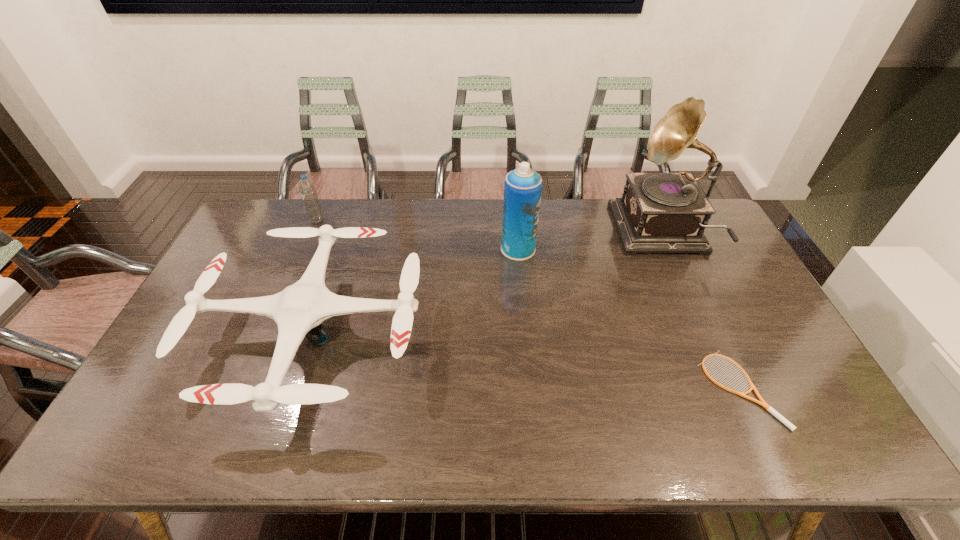
Identify the location of free space that is in between the third shortest object and the shortest object. The height and width of the screenshot is (540, 960). (529, 305).

This screenshot has width=960, height=540. Find the location of `blank region between the aerosol can and the tallest object`. blank region between the aerosol can and the tallest object is located at coordinates (589, 242).

This screenshot has height=540, width=960. I want to click on vacant area between the third tallest object and the fourth shortest object, so click(x=418, y=235).

At what (x,y) coordinates should I click in order to perform the action: click on free space between the drone and the third object from right to left. Please return your answer as a coordinate pair (x, y). The height and width of the screenshot is (540, 960). Looking at the image, I should click on (416, 291).

Locate an element on the screen. This screenshot has height=540, width=960. free space between the tallest object and the second tallest object is located at coordinates (589, 242).

The image size is (960, 540). Find the location of `free space between the aerosol can and the water bottle`. free space between the aerosol can and the water bottle is located at coordinates (418, 235).

This screenshot has width=960, height=540. Find the location of `unoccupied area between the aerosol can and the water bottle`. unoccupied area between the aerosol can and the water bottle is located at coordinates coord(418,235).

Locate an element on the screen. empty space that is in between the second shortest object and the tallest object is located at coordinates (488, 284).

The height and width of the screenshot is (540, 960). Identify the location of the closest object relative to the record player. (523, 186).

The image size is (960, 540). I want to click on object identified as the fourth closest to the drone, so click(762, 403).